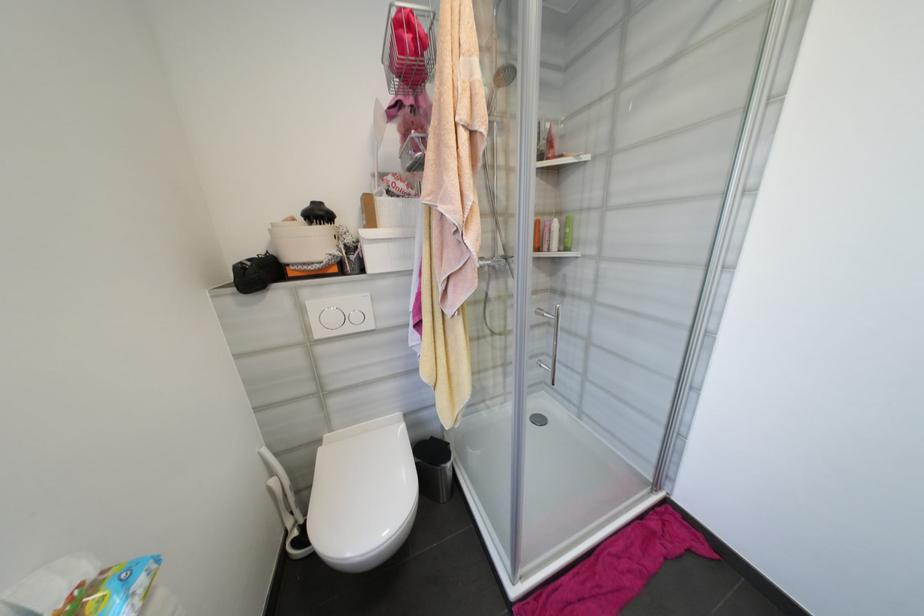
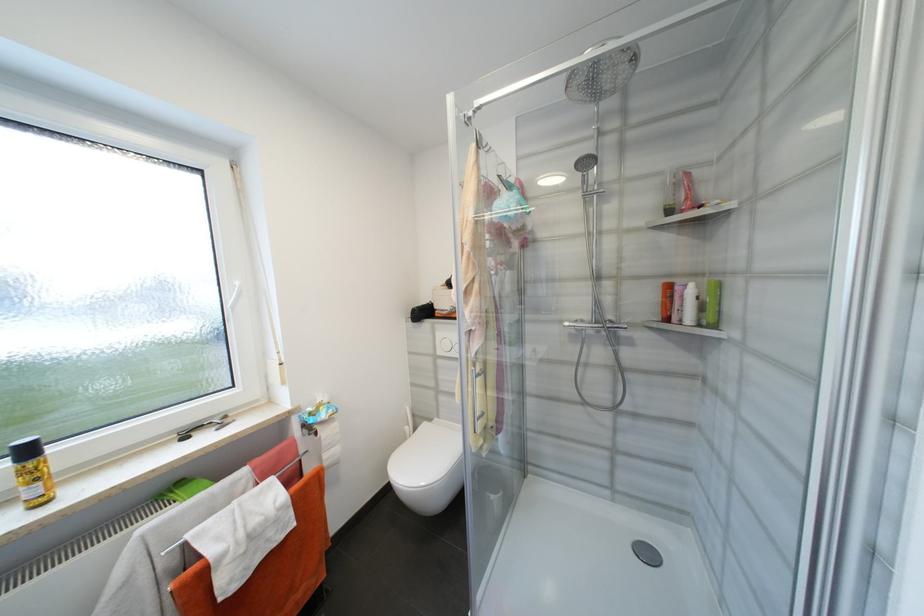
The point at (555, 231) is marked in the first image. Where is the corresponding point in the second image?

(687, 297)